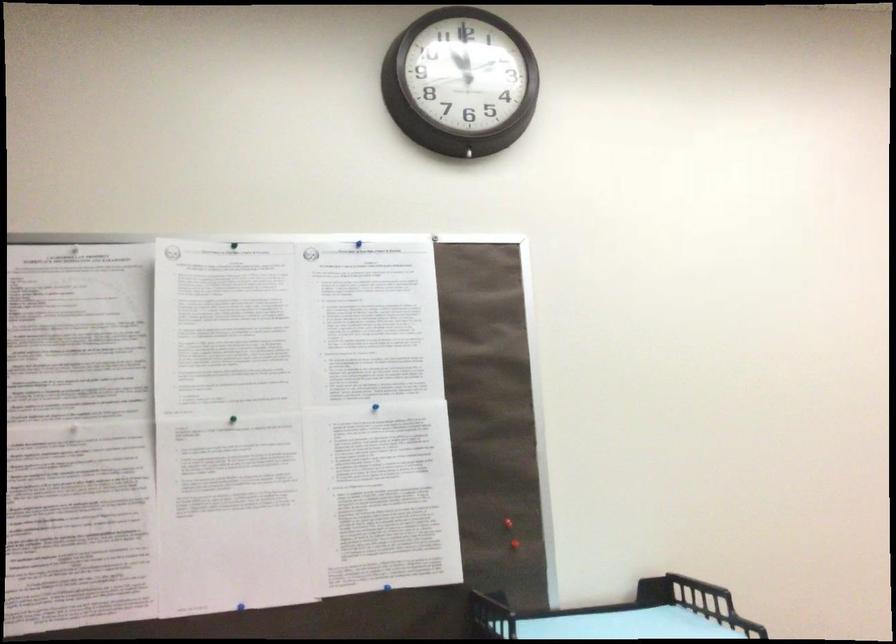
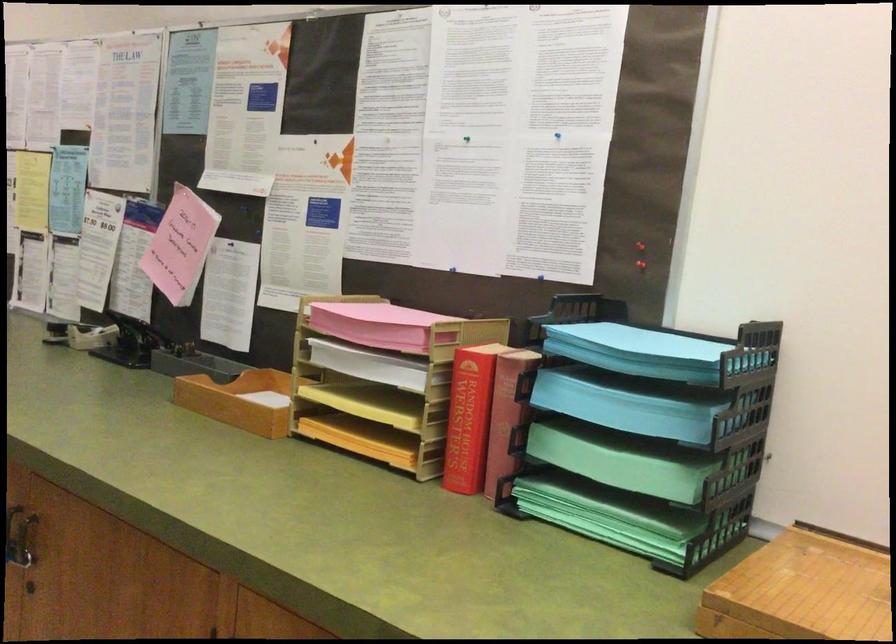
Find the pixel in the second image that matches (498,527) in the first image.

(640, 245)